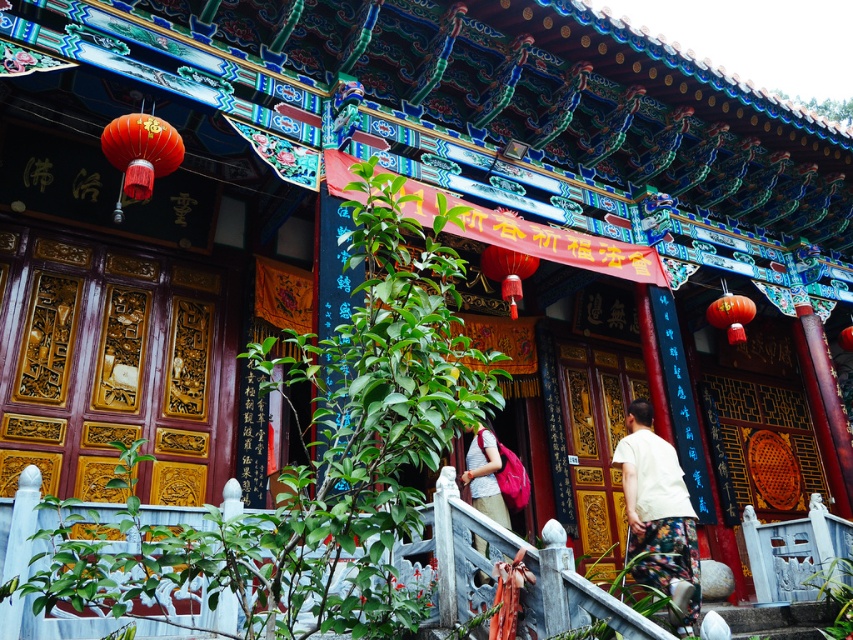
You are standing in front of the traditional Chinese building and want to take a photo. You notice two points marked on the roof. Which point, point [647,582] or point [492,477], is closer to your camera lens?

Point [647,582] is closer to the camera lens than point [492,477].